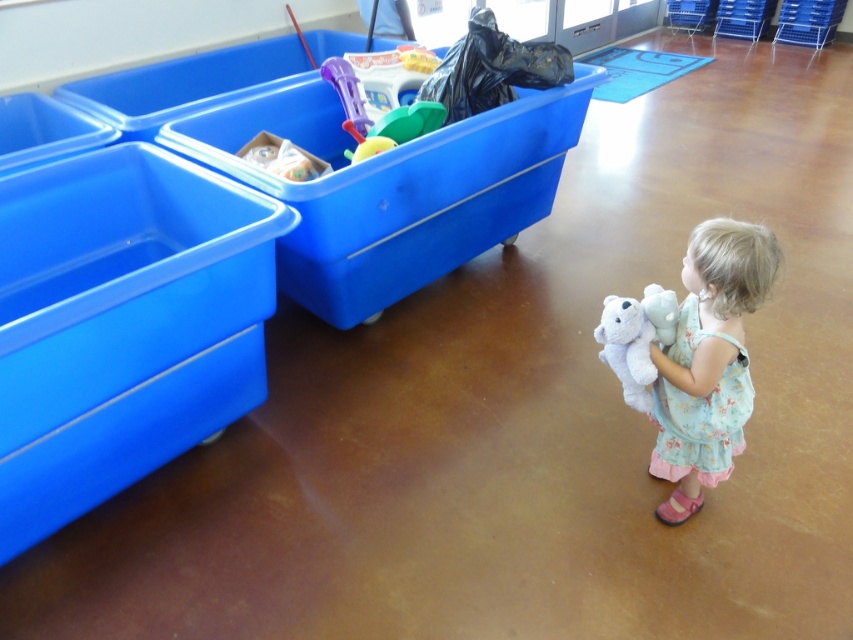
Measure the distance from blue plastic bin at left to fluffy cotton dress at lower right.

blue plastic bin at left is 3.99 feet away from fluffy cotton dress at lower right.

Is point (125, 385) positioned after point (680, 419)?

No, (125, 385) is in front of (680, 419).

Does point (115, 314) come closer to viewer compared to point (692, 266)?

Yes, it is in front of point (692, 266).

The height and width of the screenshot is (640, 853). In order to click on blue plastic bin at left in this screenshot , I will do `click(122, 324)`.

Is point (16, 541) positioned in front of point (636, 346)?

That is False.

Does blue plastic bin at left have a lesser height compared to white plush teddy bear at lower right?

In fact, blue plastic bin at left may be taller than white plush teddy bear at lower right.

Which is behind, point (132, 273) or point (627, 320)?

The point (627, 320) is behind.

The height and width of the screenshot is (640, 853). In order to click on blue plastic bin at left in this screenshot , I will do `click(122, 324)`.

Consider the image. Who is more forward, [734,340] or [635,390]?

Positioned in front is point [734,340].

Does point (761, 289) lie behind point (642, 353)?

That is False.

Locate an element on the screen. fluffy cotton dress at lower right is located at coordinates (708, 362).